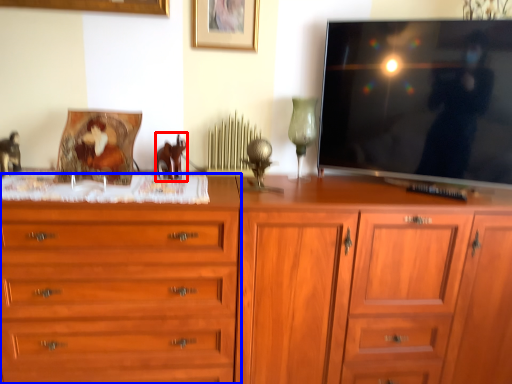
Question: Which object is closer to the camera taking this photo, animal (highlighted by a red box) or chest of drawers (highlighted by a blue box)?

Choices:
 (A) animal
 (B) chest of drawers

Answer: (B)